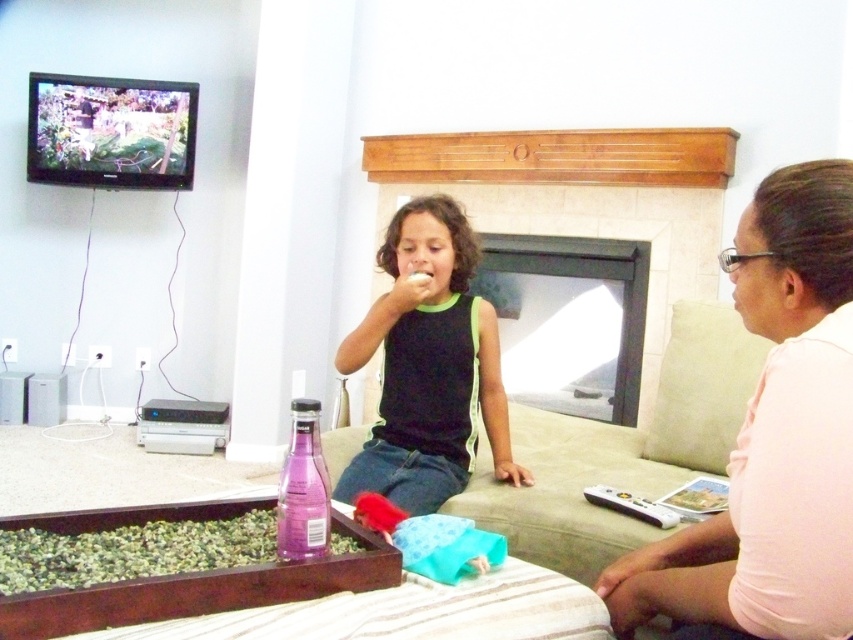
The image size is (853, 640). What do you see at coordinates (621, 451) in the screenshot?
I see `beige fabric couch at center` at bounding box center [621, 451].

Between beige fabric couch at center and white matte food at center, which one has less height?

Standing shorter between the two is white matte food at center.

Find the location of a particular element. beige fabric couch at center is located at coordinates (621, 451).

The height and width of the screenshot is (640, 853). I want to click on beige fabric couch at center, so click(x=621, y=451).

Is beige stone fireplace at center to the right of beige fabric couch at center from the viewer's perspective?

Incorrect, beige stone fireplace at center is not on the right side of beige fabric couch at center.

What do you see at coordinates (581, 198) in the screenshot? The height and width of the screenshot is (640, 853). I see `beige stone fireplace at center` at bounding box center [581, 198].

Find the location of a particular element. beige stone fireplace at center is located at coordinates (581, 198).

You are a GUI agent. You are given a task and a screenshot of the screen. Output one action in this format:
    pyautogui.click(x=<x>, y=<y>)
    Task: Click on the beige stone fireplace at center
    
    Given the screenshot: What is the action you would take?
    pyautogui.click(x=581, y=198)

Does green matte plant at lower left have a larger size compared to purple glass bottle at lower center?

Indeed, green matte plant at lower left has a larger size compared to purple glass bottle at lower center.

Who is taller, green matte plant at lower left or purple glass bottle at lower center?

Standing taller between the two is purple glass bottle at lower center.

The image size is (853, 640). What are the coordinates of `green matte plant at lower left` in the screenshot? It's located at (132, 552).